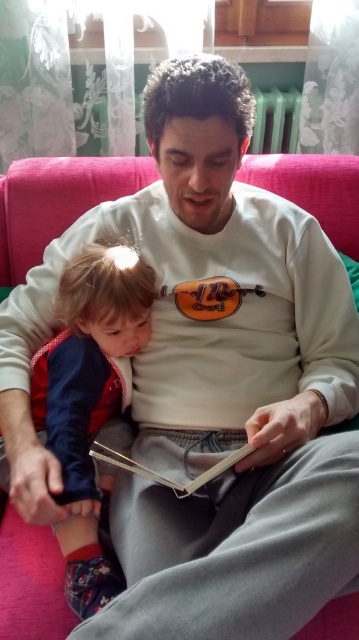
You are standing in the room and want to reach both the point at coordinates (140, 308) and the point at coordinates (229, 458). Which point will you reach first?

You will reach point (140, 308) first because it is closer to you than point (229, 458), which is further away.

You are a photographer standing at the camera position. You want to take a closeup shot of the velvet red jacket at lower left without moving the camera. Is the jacket within the camera focus range of 30 inches? Please explain.

The velvet red jacket at lower left is 29.92 inches away from camera, so it is within the camera focus range of 30 inches. Therefore, the jacket can be captured in focus without moving the camera.